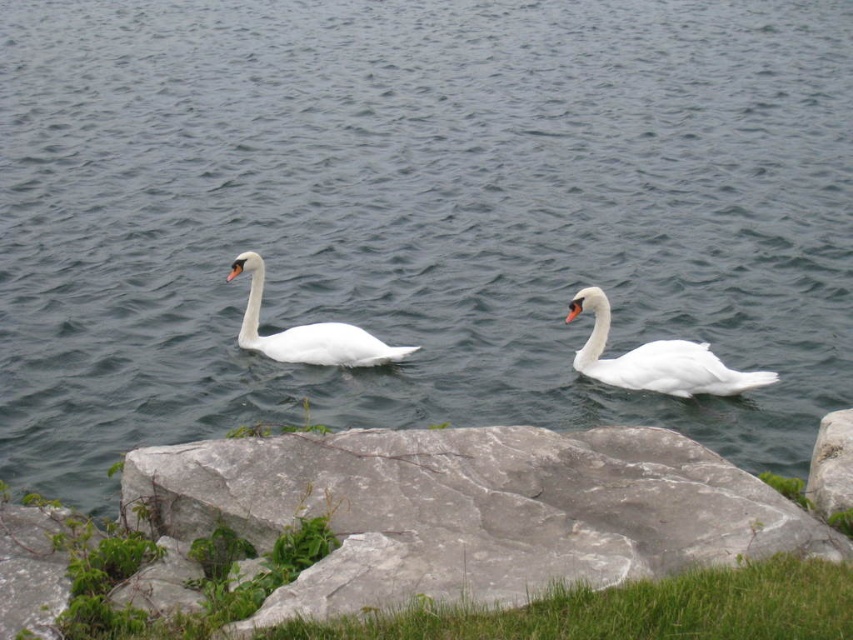
Is white glossy swan at center shorter than gray rough rock at lower right?

No, white glossy swan at center is not shorter than gray rough rock at lower right.

Can you confirm if white glossy swan at center is wider than gray rough rock at lower right?

Indeed, white glossy swan at center has a greater width compared to gray rough rock at lower right.

Who is more distant from viewer, (254, 253) or (851, 440)?

Point (254, 253)

Locate an element on the screen. The image size is (853, 640). white glossy swan at center is located at coordinates (306, 332).

In the scene shown: Measure the distance between green grass at lower center and camera.

The distance of green grass at lower center from camera is 2.90 meters.

Can you confirm if green grass at lower center is positioned below white glossy swan at center?

Yes.

Between point (805, 609) and point (364, 349), which one is positioned in front?

Point (805, 609)

Where is `green grass at lower center`? The height and width of the screenshot is (640, 853). green grass at lower center is located at coordinates (636, 611).

The width and height of the screenshot is (853, 640). What do you see at coordinates (469, 512) in the screenshot? I see `gray/rough rock at center` at bounding box center [469, 512].

Can you confirm if gray/rough rock at center is positioned above white glossy swan at right?

Actually, gray/rough rock at center is below white glossy swan at right.

Measure the distance between gray/rough rock at center and camera.

gray/rough rock at center is 10.15 feet away from camera.

The image size is (853, 640). I want to click on gray/rough rock at center, so click(469, 512).